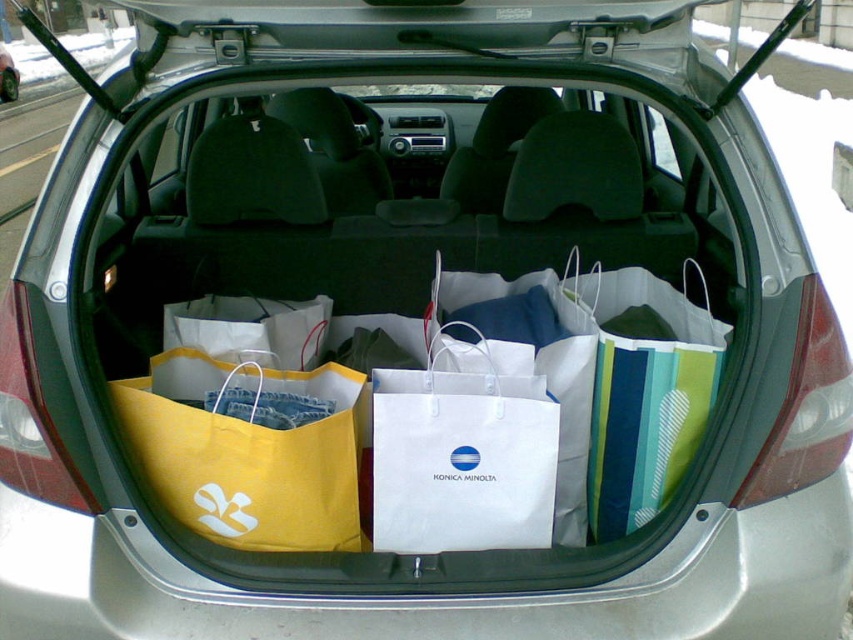
Based on the photo, you are trying to fit a new bag into the trunk of the car. The new bag is larger than the yellow paper bag at center but smaller than the white paper bag at center. Where should you place the new bag to ensure it fits without overlapping any existing bags?

The new bag should be placed in the trunk where there is enough space between the yellow paper bag at center and the white paper bag at center, as it is smaller than the white paper bag at center and larger than the yellow paper bag at center, ensuring it fits appropriately without overlapping existing bags.

You are trying to fit a new bag into the trunk of the silver car. You have a rectangular box that is 15 inches wide. You see the yellow paper bag at center and the white paper bag at center in the trunk. Which of these bags has a width that allows the box to fit next to it without overlapping?

The yellow paper bag at center has a greater width than the white paper bag at center. Since the box is 15 inches wide, if the yellow paper bag is wider, there might be less space next to it for the box. However, the exact widths aren

You are trying to retrieve the yellow paper bag at center from the trunk of the car. Is it visible above the white paper bag at center?

The yellow paper bag at center is positioned under the white paper bag at center, so it is not visible above the white paper bag at center.